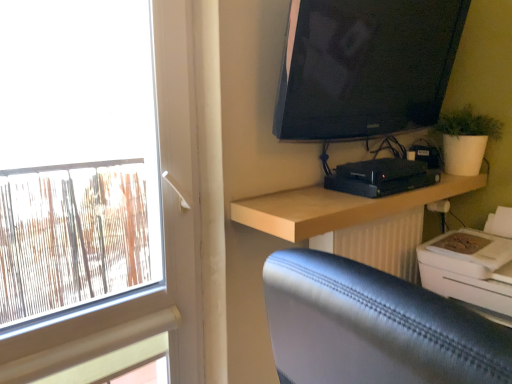
You are a GUI agent. You are given a task and a screenshot of the screen. Output one action in this format:
    pyautogui.click(x=<x>, y=<y>)
    Task: Click on the white plastic printer at lower right
    
    Given the screenshot: What is the action you would take?
    pyautogui.click(x=472, y=264)

Measure the distance between point (340,222) and camera.

Point (340,222) is 1.11 meters from camera.

Locate an element on the screen. Image resolution: width=512 pixels, height=384 pixels. light wood shelf at upper right is located at coordinates (337, 207).

What is the approximate width of white matte window at left?

white matte window at left is 2.71 inches in width.

Locate an element on the screen. white matte window at left is located at coordinates (98, 182).

You are a GUI agent. You are given a task and a screenshot of the screen. Output one action in this format:
    pyautogui.click(x=<x>, y=<y>)
    Task: Click on the black glossy tv at upper right
    The width and height of the screenshot is (512, 384).
    Given the screenshot: What is the action you would take?
    pyautogui.click(x=365, y=66)

Measure the distance between point (358,186) and camera.

The depth of point (358,186) is 1.36 meters.

What are the coordinates of `white plastic printer at lower right` in the screenshot? It's located at (472, 264).

Is white plastic printer at lower right oriented away from white matte window at left?

No, white matte window at left is not at the back of white plastic printer at lower right.

Is white matte window at left surrounded by white plastic printer at lower right?

That's incorrect, white matte window at left is not inside white plastic printer at lower right.

Considering the relative sizes of white plastic printer at lower right and white matte window at left in the image provided, is white plastic printer at lower right wider than white matte window at left?

Yes.

Which is behind, white plastic printer at lower right or white matte window at left?

white plastic printer at lower right is more distant.

From a real-world perspective, who is located lower, black glossy tv at upper right or black plastic device at center?

From a 3D spatial view, black plastic device at center is below.

Can you confirm if black glossy tv at upper right is taller than black plastic device at center?

Correct, black glossy tv at upper right is much taller as black plastic device at center.

Which is correct: black glossy tv at upper right is inside black plastic device at center, or outside of it?

black glossy tv at upper right is not inside black plastic device at center, it's outside.

Can you tell me how much white plastic printer at lower right and black glossy tv at upper right differ in facing direction?

88.4 degrees.

Relative to black glossy tv at upper right, is white plastic printer at lower right in front or behind?

Visually, white plastic printer at lower right is located behind black glossy tv at upper right.

From the image's perspective, which is below, white plastic printer at lower right or black glossy tv at upper right?

white plastic printer at lower right, from the image's perspective.

Is white plastic printer at lower right facing away from black glossy tv at upper right?

No, white plastic printer at lower right is not facing the opposite direction of black glossy tv at upper right.

From the image's perspective, which is above, light wood shelf at upper right or white plastic printer at lower right?

A: light wood shelf at upper right is shown above in the image.

Could you tell me if light wood shelf at upper right is turned towards white plastic printer at lower right?

No, light wood shelf at upper right is not oriented towards white plastic printer at lower right.

Considering the sizes of objects light wood shelf at upper right and white plastic printer at lower right in the image provided, who is smaller, light wood shelf at upper right or white plastic printer at lower right?

With smaller size is light wood shelf at upper right.

Is light wood shelf at upper right next to white plastic printer at lower right?

light wood shelf at upper right and white plastic printer at lower right are clearly separated.

You are a GUI agent. You are given a task and a screenshot of the screen. Output one action in this format:
    pyautogui.click(x=<x>, y=<y>)
    Task: Click on the equipment in front of the white plastic printer at lower right
    The image size is (512, 384).
    Given the screenshot: What is the action you would take?
    pyautogui.click(x=381, y=177)

Considering the positions of points (457, 299) and (412, 179), is point (457, 299) closer to camera compared to point (412, 179)?

Yes, it is in front of point (412, 179).

Considering the relative sizes of white plastic printer at lower right and black plastic device at center in the image provided, is white plastic printer at lower right taller than black plastic device at center?

Correct, white plastic printer at lower right is much taller as black plastic device at center.

Between white plastic printer at lower right and light wood shelf at upper right, which one has less height?

Standing shorter between the two is light wood shelf at upper right.

Based on the photo, measure the distance between white plastic printer at lower right and light wood shelf at upper right.

white plastic printer at lower right and light wood shelf at upper right are 11.50 inches apart.

From the picture: Considering the relative sizes of white plastic printer at lower right and light wood shelf at upper right in the image provided, is white plastic printer at lower right thinner than light wood shelf at upper right?

No.

Does white plastic printer at lower right appear on the left side of light wood shelf at upper right?

No.

Is black plastic device at center far away from light wood shelf at upper right?

No, black plastic device at center is not far away from light wood shelf at upper right.

Which is further, (x=414, y=185) or (x=282, y=211)?

The point (x=414, y=185) is behind.

At what (x,y) coordinates should I click in order to perform the action: click on window in front of the white plastic printer at lower right. Please return your answer as a coordinate pair (x, y). The width and height of the screenshot is (512, 384). Looking at the image, I should click on [x=98, y=182].

Image resolution: width=512 pixels, height=384 pixels. I want to click on television above the black plastic device at center (from the image's perspective), so click(x=365, y=66).

Looking at the image, which one is located further to white matte window at left, white plastic printer at lower right or light wood shelf at upper right?

white plastic printer at lower right.

Which object lies further to the anchor point black plastic device at center, white plastic printer at lower right or white matte window at left?

Based on the image, white matte window at left appears to be further to black plastic device at center.

From the image, which object appears to be farther from white matte window at left, black plastic device at center or white plastic printer at lower right?

The object further to white matte window at left is white plastic printer at lower right.

Considering their positions, is black plastic device at center positioned closer to white plastic printer at lower right than white matte window at left?

Based on the image, black plastic device at center appears to be nearer to white plastic printer at lower right.

Based on their spatial positions, is white matte window at left or black glossy tv at upper right further from white plastic printer at lower right?

The object further to white plastic printer at lower right is white matte window at left.

In the scene shown: Based on their spatial positions, is light wood shelf at upper right or white matte window at left closer to black plastic device at center?

light wood shelf at upper right is positioned closer to the anchor black plastic device at center.

When comparing their distances from black plastic device at center, does black glossy tv at upper right or white plastic printer at lower right seem closer?

The object closer to black plastic device at center is black glossy tv at upper right.

Based on their spatial positions, is white matte window at left or black glossy tv at upper right further from light wood shelf at upper right?

Based on the image, white matte window at left appears to be further to light wood shelf at upper right.

At what (x,y) coordinates should I click in order to perform the action: click on shelf between white matte window at left and white plastic printer at lower right from left to right. Please return your answer as a coordinate pair (x, y). Looking at the image, I should click on (337, 207).

What are the coordinates of `television between white matte window at left and white plastic printer at lower right` in the screenshot? It's located at 365,66.

At what (x,y) coordinates should I click in order to perform the action: click on equipment between white matte window at left and white plastic printer at lower right in the horizontal direction. Please return your answer as a coordinate pair (x, y). Image resolution: width=512 pixels, height=384 pixels. Looking at the image, I should click on (381, 177).

Find the location of a particular element. The image size is (512, 384). shelf located between white matte window at left and black plastic device at center in the left-right direction is located at coordinates (337, 207).